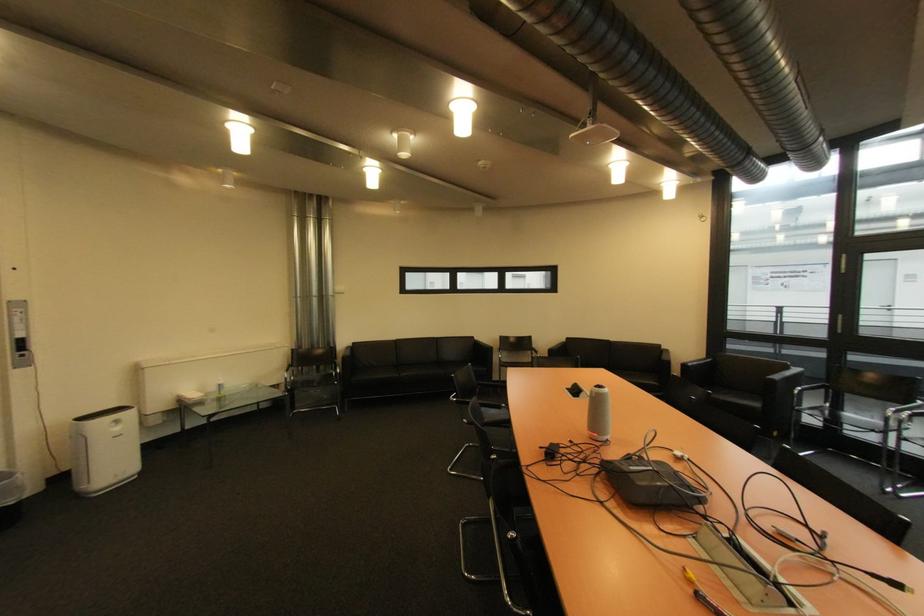
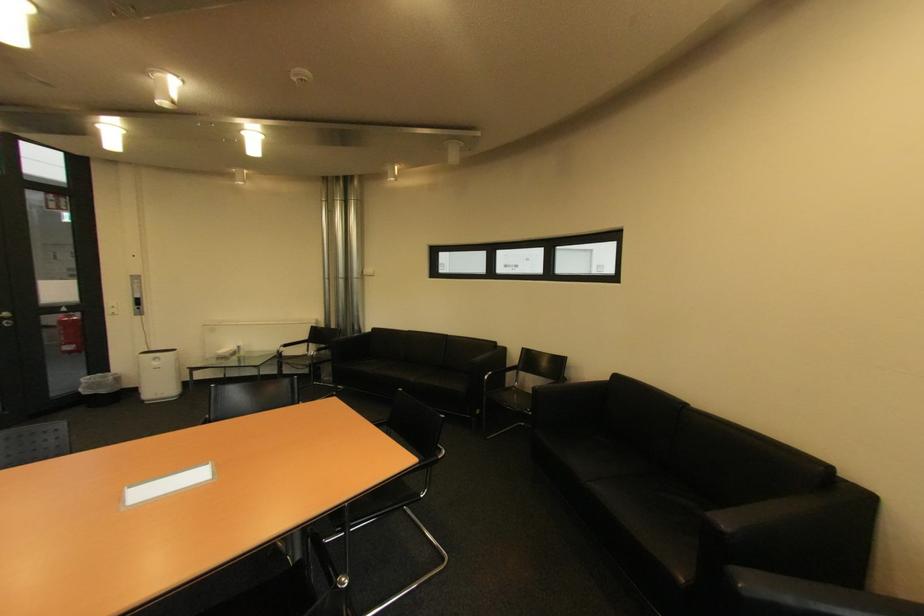
The point at (576, 339) is marked in the first image. Where is the corresponding point in the second image?

(625, 378)